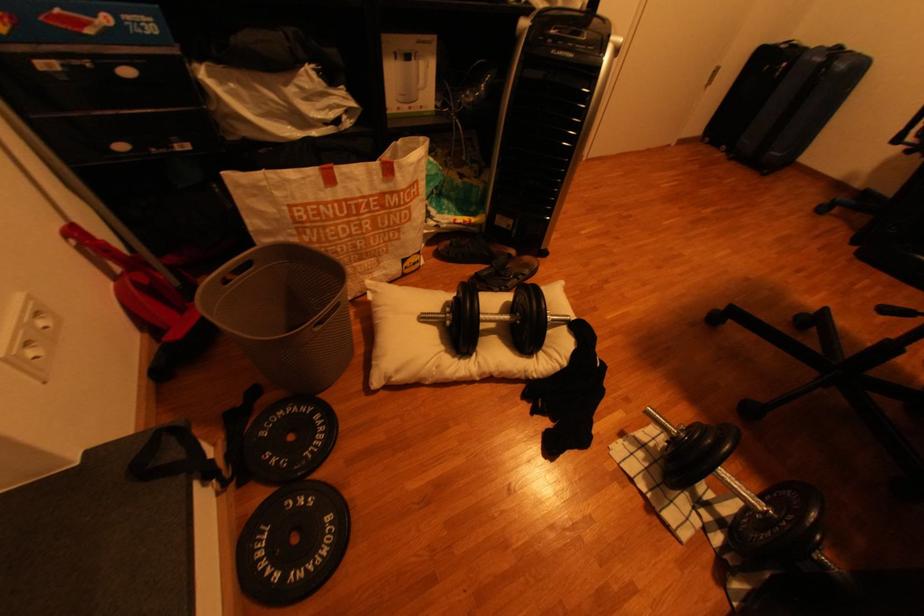
Where would you pull the grey bin handle? Please return your answer as a coordinate pair (x, y).

(329, 314)